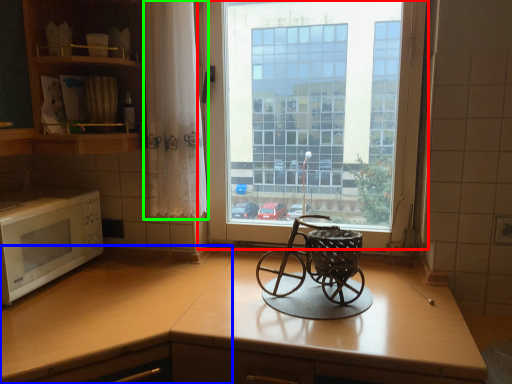
Question: Based on their relative distances, which object is nearer to window (highlighted by a red box)? Choose from counter top (highlighted by a blue box) and curtain (highlighted by a green box).

Choices:
 (A) counter top
 (B) curtain

Answer: (B)